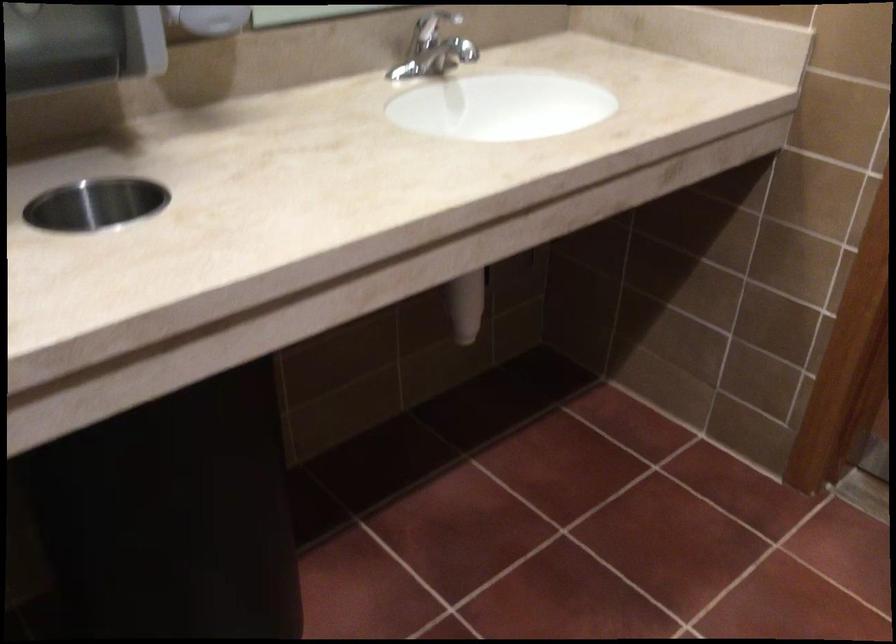
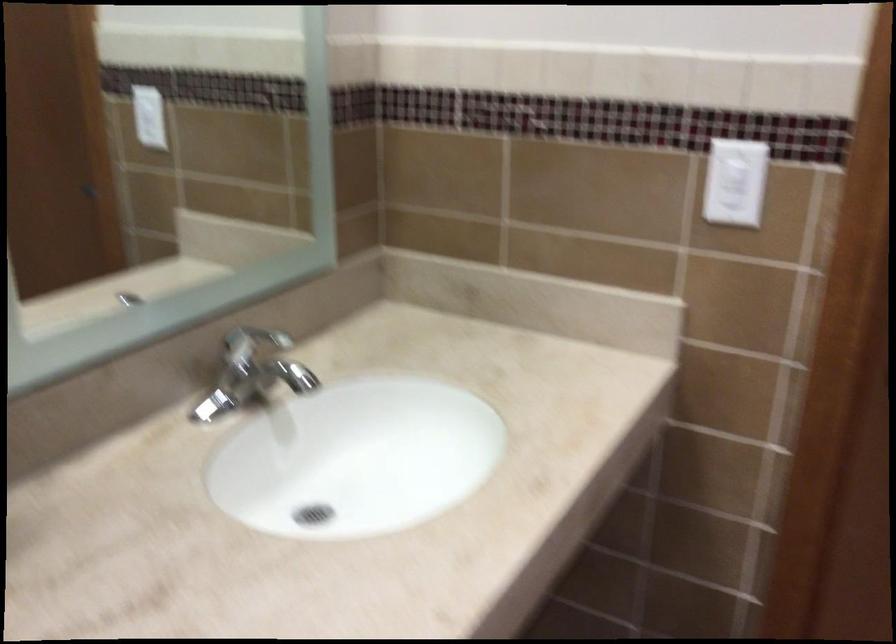
Question: The camera is either moving clockwise (left) or counter-clockwise (right) around the object. The first image is from the beginning of the video and the second image is from the end. Is the camera moving left or right when shooting the video?

Choices:
 (A) Left
 (B) Right

Answer: (A)